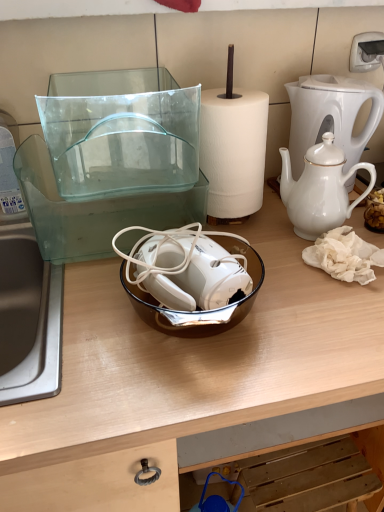
You are a GUI agent. You are given a task and a screenshot of the screen. Output one action in this format:
    pyautogui.click(x=<x>, y=<y>)
    Task: Click on the free space underneath brown glass bowl at center (from a real-world perspective)
    The height and width of the screenshot is (512, 384).
    Given the screenshot: What is the action you would take?
    pyautogui.click(x=184, y=322)